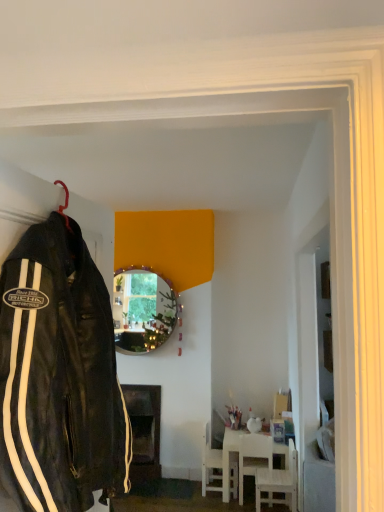
The width and height of the screenshot is (384, 512). What do you see at coordinates (142, 310) in the screenshot?
I see `shiny gold mirror at center` at bounding box center [142, 310].

Measure the distance between black leather jacket at left and camera.

They are 33.44 inches apart.

In order to face wooden table at center, acting as the 2th table starting from the right, should I rotate leftwards or rightwards?

Turn left by 7.651 degrees to look at wooden table at center, acting as the 2th table starting from the right.

What are the coordinates of `shiny gold mirror at center` in the screenshot? It's located at (142, 310).

From the image's perspective, is white wood chair at lower center, acting as the second chair starting from the left, located beneath wooden table at center, which is the 1th table in left-to-right order?

Indeed, from the image's perspective, white wood chair at lower center, acting as the second chair starting from the left, is shown beneath wooden table at center, which is the 1th table in left-to-right order.

Consider the image. Is white wood chair at lower center, acting as the second chair starting from the left, aimed at wooden table at center, acting as the 2th table starting from the right?

No.

In the scene shown: Which point is more forward, (242, 457) or (153, 411)?

The point (242, 457) is in front.

Which is more to the right, white wood chair at lower center, placed as the 2th chair when sorted from right to left, or wooden table at center, acting as the 2th table starting from the right?

From the viewer's perspective, white wood chair at lower center, placed as the 2th chair when sorted from right to left, appears more on the right side.

Considering the sizes of white plastic chair at lower center, which is the first chair from left to right, and white wooden chair at lower right, arranged as the 3th chair when viewed from the left, in the image, is white plastic chair at lower center, which is the first chair from left to right, wider or thinner than white wooden chair at lower right, arranged as the 3th chair when viewed from the left,?

Considering their sizes, white plastic chair at lower center, which is the first chair from left to right, looks slimmer than white wooden chair at lower right, arranged as the 3th chair when viewed from the left.

Which of these two, white plastic chair at lower center, which is the first chair from left to right, or white wooden chair at lower right, the first chair from the right, stands taller?

white plastic chair at lower center, which is the first chair from left to right.

What's the angular difference between white plastic chair at lower center, which is the first chair from left to right, and white wooden chair at lower right, arranged as the 3th chair when viewed from the left,'s facing directions?

180 degrees.

Is white plastic chair at lower center, positioned as the 3th chair in right-to-left order, facing towards white wooden chair at lower right, arranged as the 3th chair when viewed from the left?

No, white plastic chair at lower center, positioned as the 3th chair in right-to-left order, is not aimed at white wooden chair at lower right, arranged as the 3th chair when viewed from the left.

Does point (137, 447) come behind point (97, 397)?

Yes, it is.

Is wooden table at center, which is the 1th table in left-to-right order, oriented towards black leather jacket at left?

Yes, wooden table at center, which is the 1th table in left-to-right order, is aimed at black leather jacket at left.

Which object is further away from the camera, wooden table at center, acting as the 2th table starting from the right, or black leather jacket at left?

wooden table at center, acting as the 2th table starting from the right, is more distant.

From a real-world perspective, starting from the white wooden chair at lower right, the first chair from the right, which chair is the 2nd one vertically above it? Please provide its 2D coordinates.

[(211, 465)]

Is white wooden chair at lower right, the first chair from the right, aimed at white plastic chair at lower center, positioned as the 3th chair in right-to-left order?

No, white wooden chair at lower right, the first chair from the right, is not turned towards white plastic chair at lower center, positioned as the 3th chair in right-to-left order.

Is white wooden chair at lower right, the first chair from the right, taller or shorter than white plastic chair at lower center, positioned as the 3th chair in right-to-left order?

Considering their sizes, white wooden chair at lower right, the first chair from the right, has less height than white plastic chair at lower center, positioned as the 3th chair in right-to-left order.

Considering the positions of objects shiny gold mirror at center and white wooden chair at lower right, arranged as the 3th chair when viewed from the left, in the image provided, who is more to the left, shiny gold mirror at center or white wooden chair at lower right, arranged as the 3th chair when viewed from the left,?

shiny gold mirror at center is more to the left.

Which object is closer to the camera, shiny gold mirror at center or white wooden chair at lower right, the first chair from the right?

white wooden chair at lower right, the first chair from the right, is closer to the camera.

Which is behind, point (119, 273) or point (273, 443)?

The point (119, 273) is farther from the camera.

The height and width of the screenshot is (512, 384). Find the location of `mirror on the left of white wooden chair at lower right, the first chair from the right`. mirror on the left of white wooden chair at lower right, the first chair from the right is located at coordinates (142, 310).

Who is more distant, white wooden chair at lower right, arranged as the 3th chair when viewed from the left, or white matte table at lower center, marked as the first table in a right-to-left arrangement?

Positioned behind is white matte table at lower center, marked as the first table in a right-to-left arrangement.

Is white wooden chair at lower right, arranged as the 3th chair when viewed from the left, positioned far away from white matte table at lower center, acting as the second table starting from the left?

No, white wooden chair at lower right, arranged as the 3th chair when viewed from the left, is not far from white matte table at lower center, acting as the second table starting from the left.

From the image's perspective, which is above, white wooden chair at lower right, arranged as the 3th chair when viewed from the left, or white matte table at lower center, acting as the second table starting from the left?

white wooden chair at lower right, arranged as the 3th chair when viewed from the left, from the image's perspective.

Considering the points (43, 396) and (254, 449), which point is in front, point (43, 396) or point (254, 449)?

The point (43, 396) is closer to the camera.

Considering the sizes of objects black leather jacket at left and white wood chair at lower center, placed as the 2th chair when sorted from right to left, in the image provided, who is bigger, black leather jacket at left or white wood chair at lower center, placed as the 2th chair when sorted from right to left,?

Bigger between the two is black leather jacket at left.

Considering the relative sizes of black leather jacket at left and white wood chair at lower center, acting as the second chair starting from the left, in the image provided, is black leather jacket at left taller than white wood chair at lower center, acting as the second chair starting from the left,?

Correct, black leather jacket at left is much taller as white wood chair at lower center, acting as the second chair starting from the left.

Which is behind, black leather jacket at left or white wood chair at lower center, placed as the 2th chair when sorted from right to left?

white wood chair at lower center, placed as the 2th chair when sorted from right to left, is further away from the camera.

Where is `the 2nd table behind the white wood chair at lower center, acting as the second chair starting from the left`? This screenshot has width=384, height=512. the 2nd table behind the white wood chair at lower center, acting as the second chair starting from the left is located at coordinates (144, 430).

Identify the location of the 2nd chair below the white wooden chair at lower right, arranged as the 3th chair when viewed from the left (from the image's perspective). (211, 465).

When comparing their distances from shiny gold mirror at center, does white matte table at lower center, acting as the second table starting from the left, or black leather jacket at left seem further?

black leather jacket at left is further to shiny gold mirror at center.

Which object lies nearer to the anchor point white plastic chair at lower center, which is the first chair from left to right, white wood chair at lower center, acting as the second chair starting from the left, or white wooden chair at lower right, the first chair from the right?

Among the two, white wood chair at lower center, acting as the second chair starting from the left, is located nearer to white plastic chair at lower center, which is the first chair from left to right.

Based on the photo, when comparing their distances from black leather jacket at left, does wooden table at center, acting as the 2th table starting from the right, or shiny gold mirror at center seem closer?

shiny gold mirror at center.

Based on their spatial positions, is black leather jacket at left or white wood chair at lower center, placed as the 2th chair when sorted from right to left, further from wooden table at center, which is the 1th table in left-to-right order?

black leather jacket at left lies further to wooden table at center, which is the 1th table in left-to-right order, than the other object.

In the scene shown: Based on their spatial positions, is white wood chair at lower center, acting as the second chair starting from the left, or white plastic chair at lower center, which is the first chair from left to right, further from white matte table at lower center, marked as the first table in a right-to-left arrangement?

Based on the image, white wood chair at lower center, acting as the second chair starting from the left, appears to be further to white matte table at lower center, marked as the first table in a right-to-left arrangement.

Which object lies nearer to the anchor point shiny gold mirror at center, wooden table at center, acting as the 2th table starting from the right, or white matte table at lower center, marked as the first table in a right-to-left arrangement?

wooden table at center, acting as the 2th table starting from the right, is closer to shiny gold mirror at center.

Based on their spatial positions, is white wooden chair at lower right, the first chair from the right, or white matte table at lower center, marked as the first table in a right-to-left arrangement, closer to white plastic chair at lower center, positioned as the 3th chair in right-to-left order?

white matte table at lower center, marked as the first table in a right-to-left arrangement.

Based on their spatial positions, is wooden table at center, which is the 1th table in left-to-right order, or white matte table at lower center, acting as the second table starting from the left, closer to white plastic chair at lower center, which is the first chair from left to right?

white matte table at lower center, acting as the second table starting from the left, is positioned closer to the anchor white plastic chair at lower center, which is the first chair from left to right.

Find the location of `chair between white plastic chair at lower center, which is the first chair from left to right, and white matte table at lower center, marked as the first table in a right-to-left arrangement, in the horizontal direction`. chair between white plastic chair at lower center, which is the first chair from left to right, and white matte table at lower center, marked as the first table in a right-to-left arrangement, in the horizontal direction is located at coordinates (253, 457).

This screenshot has height=512, width=384. I want to click on chair between shiny gold mirror at center and white wood chair at lower center, placed as the 2th chair when sorted from right to left, vertically, so click(x=278, y=482).

The width and height of the screenshot is (384, 512). In order to click on table between wooden table at center, acting as the 2th table starting from the right, and white wooden chair at lower right, the first chair from the right, in the horizontal direction in this screenshot , I will do `click(229, 456)`.

Where is `table between shiny gold mirror at center and white wood chair at lower center, acting as the second chair starting from the left, vertically`? The image size is (384, 512). table between shiny gold mirror at center and white wood chair at lower center, acting as the second chair starting from the left, vertically is located at coordinates (144, 430).